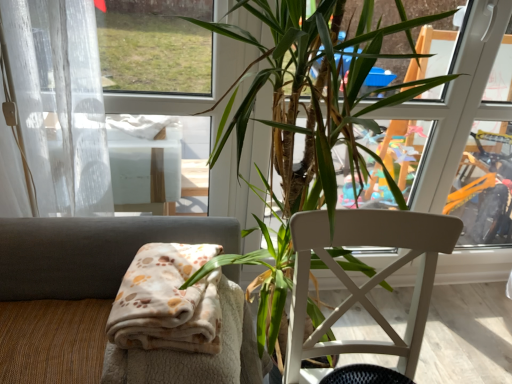
Question: From a real-world perspective, is green leafy plant at center physically located above or below beige fabric chair at lower left, the 2th chair when ordered from right to left?

Choices:
 (A) above
 (B) below

Answer: (A)

Question: Would you say green leafy plant at center is inside or outside beige fabric chair at lower left, the 2th chair when ordered from right to left?

Choices:
 (A) inside
 (B) outside

Answer: (B)

Question: Based on their relative distances, which object is farther from the white sheer curtain at left?

Choices:
 (A) beige fabric chair at lower left, the 2th chair when ordered from right to left
 (B) white wood chair at center, which appears as the second chair when viewed from the left
 (C) green leafy plant at center

Answer: (B)

Question: Estimate the real-world distances between objects in this image. Which object is farther from the beige fabric chair at lower left, the 2th chair when ordered from right to left?

Choices:
 (A) green leafy plant at center
 (B) white wood chair at center, which appears as the second chair when viewed from the left
 (C) white sheer curtain at left

Answer: (B)